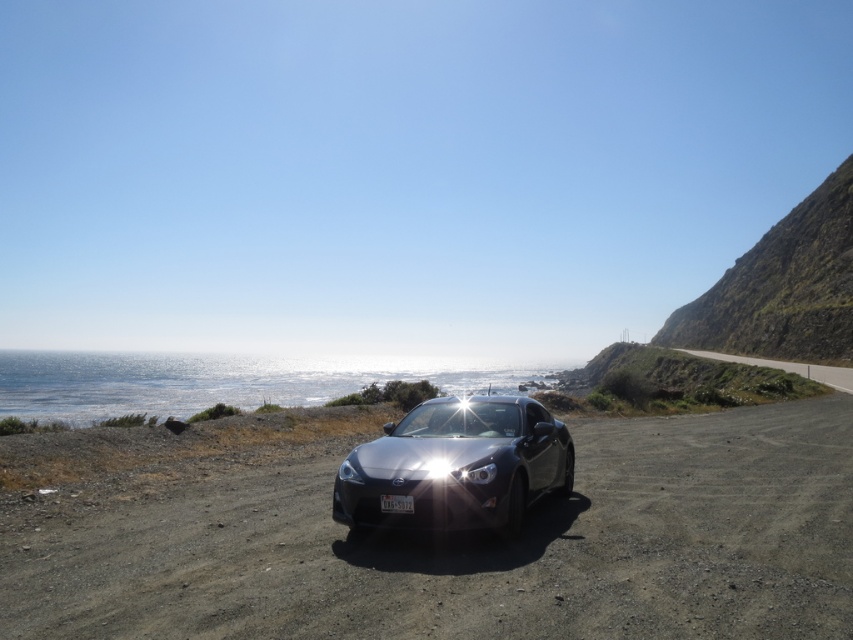
Does sandy/dirt road at center appear over satin silver car at center?

No.

Between sandy/dirt road at center and satin silver car at center, which one has less height?

sandy/dirt road at center is shorter.

Which is in front, point (654, 568) or point (509, 413)?

Point (654, 568) is in front.

The image size is (853, 640). Find the location of `sandy/dirt road at center`. sandy/dirt road at center is located at coordinates (469, 547).

Is point (337, 484) positioned behind point (428, 477)?

Yes.

Does satin silver car at center appear on the left side of matte silver headlight at center?

In fact, satin silver car at center is to the right of matte silver headlight at center.

Is point (495, 488) less distant than point (433, 456)?

Yes, it is.

The width and height of the screenshot is (853, 640). I want to click on satin silver car at center, so click(456, 467).

Does sandy/dirt road at center appear on the left side of matte silver headlight at center?

No, sandy/dirt road at center is not to the left of matte silver headlight at center.

Can you confirm if sandy/dirt road at center is bigger than matte silver headlight at center?

Yes, sandy/dirt road at center is bigger than matte silver headlight at center.

Who is more forward, (x=412, y=628) or (x=450, y=472)?

Point (x=412, y=628)

The width and height of the screenshot is (853, 640). In order to click on sandy/dirt road at center in this screenshot , I will do `click(469, 547)`.